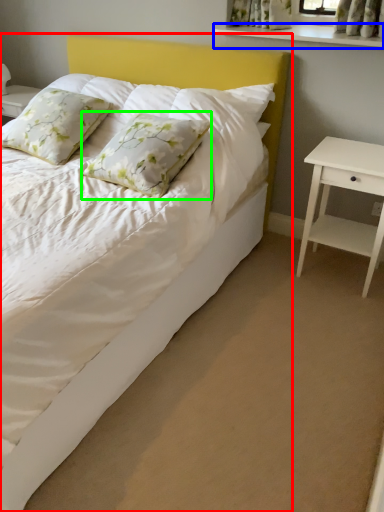
Question: Based on their relative distances, which object is farther from bed (highlighted by a red box)? Choose from window sill (highlighted by a blue box) and pillow (highlighted by a green box).

Choices:
 (A) window sill
 (B) pillow

Answer: (A)